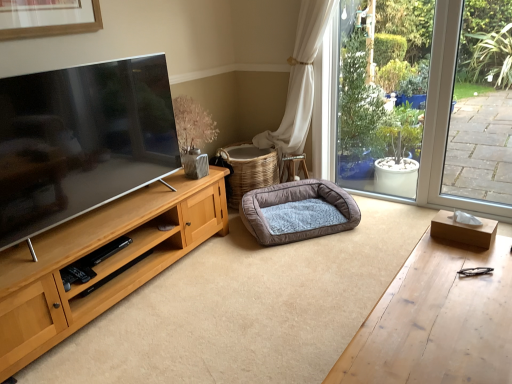
Describe the element at coordinates (437, 321) in the screenshot. The image size is (512, 384). I see `wooden desk at lower right` at that location.

Identify the location of wooden desk at lower right. The width and height of the screenshot is (512, 384). (437, 321).

Image resolution: width=512 pixels, height=384 pixels. Describe the element at coordinates (300, 218) in the screenshot. I see `brown plush dog bed at center` at that location.

In order to click on wooden desk at lower right in this screenshot , I will do `click(437, 321)`.

Is woven brown basket at center facing towards brown plush dog bed at center?

Yes.

Does point (268, 182) come behind point (329, 233)?

That is True.

Does woven brown basket at center come in front of brown plush dog bed at center?

No, woven brown basket at center is behind brown plush dog bed at center.

Is brown plush dog bed at center a part of woven brown basket at center?

Actually, brown plush dog bed at center is outside woven brown basket at center.

Considering the points (282, 199) and (422, 320), which point is behind, point (282, 199) or point (422, 320)?

The point (282, 199) is behind.

From the image's perspective, which is above, brown plush dog bed at center or wooden desk at lower right?

brown plush dog bed at center appears higher in the image.

Does brown plush dog bed at center have a lesser height compared to wooden desk at lower right?

Indeed, brown plush dog bed at center has a lesser height compared to wooden desk at lower right.

Which of these two, brown plush dog bed at center or wooden desk at lower right, is wider?

Wider between the two is brown plush dog bed at center.

Which point is more forward, (463, 314) or (272, 186)?

The point (463, 314) is in front.

Is wooden desk at lower right completely or partially outside of brown plush dog bed at center?

That's correct, wooden desk at lower right is outside of brown plush dog bed at center.

Which is more to the left, wooden desk at lower right or brown plush dog bed at center?

brown plush dog bed at center.

From the picture: From the image's perspective, which one is positioned lower, woven brown basket at center or wooden desk at lower right?

wooden desk at lower right.

Looking at this image, between woven brown basket at center and wooden desk at lower right, which one has more height?

Standing taller between the two is woven brown basket at center.

Between woven brown basket at center and wooden desk at lower right, which one has larger width?

Wider between the two is woven brown basket at center.

Does point (241, 155) come farther from viewer compared to point (480, 375)?

Yes, it is behind point (480, 375).

Between wooden desk at lower right and woven brown basket at center, which one has smaller size?

With smaller size is woven brown basket at center.

Looking at their sizes, would you say wooden desk at lower right is wider or thinner than woven brown basket at center?

wooden desk at lower right is thinner than woven brown basket at center.

Based on the photo, which is further, (407, 312) or (259, 175)?

The point (259, 175) is farther.

Measure the distance from wooden desk at lower right to woven brown basket at center.

wooden desk at lower right and woven brown basket at center are 1.79 meters apart.

Which is more to the left, brown plush dog bed at center or woven brown basket at center?

Positioned to the left is woven brown basket at center.

Locate an element on the screen. The height and width of the screenshot is (384, 512). basket above the brown plush dog bed at center (from a real-world perspective) is located at coordinates (248, 170).

Can you tell me how much brown plush dog bed at center and woven brown basket at center differ in facing direction?

The facing directions of brown plush dog bed at center and woven brown basket at center are 6.11 degrees apart.

You are a GUI agent. You are given a task and a screenshot of the screen. Output one action in this format:
    pyautogui.click(x=<x>, y=<y>)
    Task: Click on the dog bed in front of the woven brown basket at center
    
    Given the screenshot: What is the action you would take?
    pyautogui.click(x=300, y=218)

Image resolution: width=512 pixels, height=384 pixels. In order to click on dog bed located behind the wooden desk at lower right in this screenshot , I will do `click(300, 218)`.

Estimate the real-world distances between objects in this image. Which object is closer to brown plush dog bed at center, wooden desk at lower right or woven brown basket at center?

woven brown basket at center lies closer to brown plush dog bed at center than the other object.

When comparing their distances from brown plush dog bed at center, does woven brown basket at center or wooden desk at lower right seem further?

Based on the image, wooden desk at lower right appears to be further to brown plush dog bed at center.

Based on their spatial positions, is wooden desk at lower right or brown plush dog bed at center closer to woven brown basket at center?

The object closer to woven brown basket at center is brown plush dog bed at center.

Based on their spatial positions, is woven brown basket at center or brown plush dog bed at center further from wooden desk at lower right?

woven brown basket at center is further to wooden desk at lower right.

Looking at the image, which one is located closer to wooden desk at lower right, brown plush dog bed at center or woven brown basket at center?

brown plush dog bed at center is closer to wooden desk at lower right.

Considering their positions, is brown plush dog bed at center positioned closer to woven brown basket at center than wooden desk at lower right?

Among the two, brown plush dog bed at center is located nearer to woven brown basket at center.

Locate an element on the screen. dog bed between wooden desk at lower right and woven brown basket at center in the front-back direction is located at coordinates (300, 218).